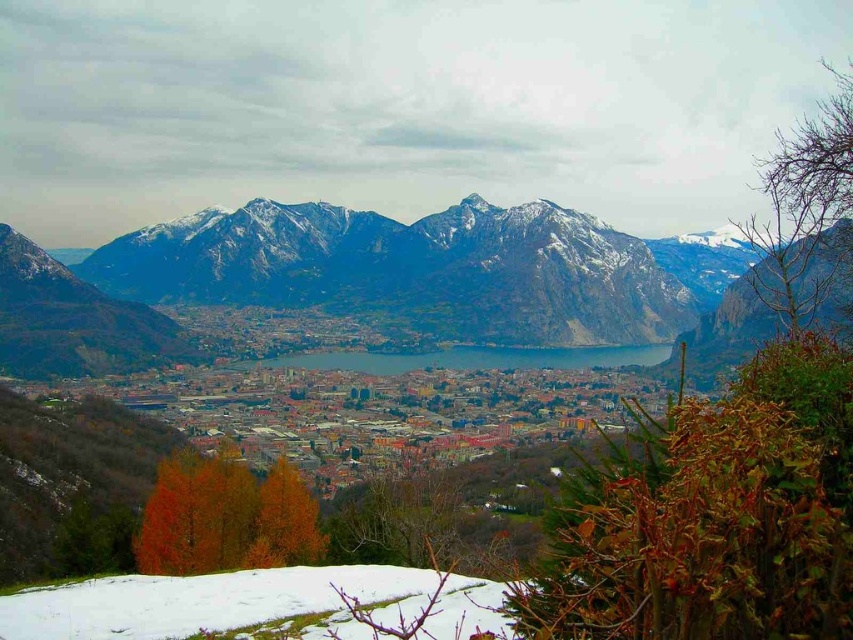
You are standing at the center of the image and want to find the snowy rock mountain range at upper center. Which direction should you look to see it?

The snowy rock mountain range at upper center is located at point (415,272), so you should look towards the upper center direction to see it.

You are an outdoor enthusiast planning a hike and see the white fluffy snow at lower left and the blue glass lake at center in the distance. Which object is closer to you as you start your hike?

The white fluffy snow at lower left is closer to you because it is positioned under the blue glass lake at center, indicating it is in the foreground of the scene.

You are a hiker planning to take a photo of the snowy rock mountain range at upper center. You are currently standing at the point marked by point (415, 272). Is the snowy rock mountain range at upper center visible from your current location?

Yes, the point (415, 272) marks the snowy rock mountain range at upper center, so you are already at that location and can see it clearly.